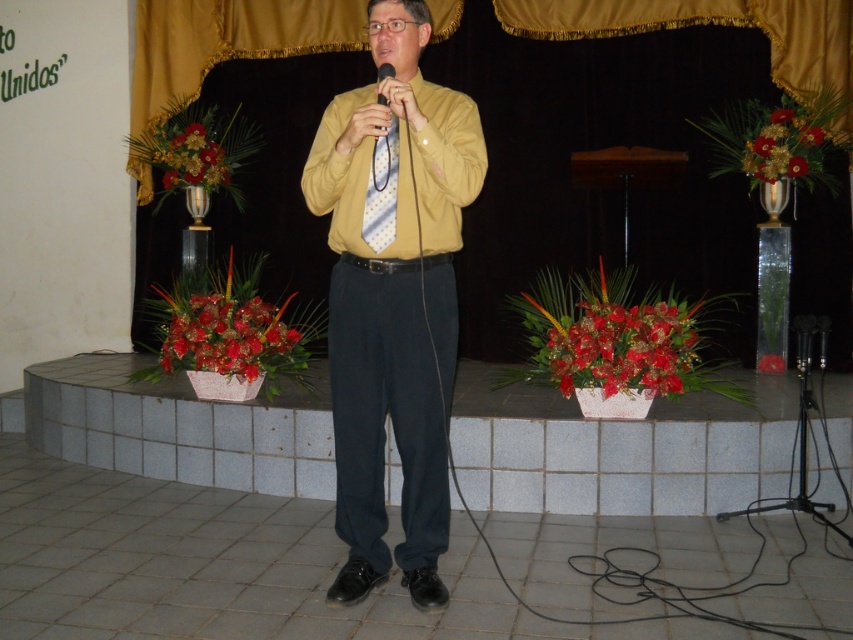
You are an audience member sitting in the front row of the stage. You want to hand the speaker a note. The note is in your pocket, and you need to reach out to him. Considering the distance between you and the yellow matte shirt at center, is it possible to reach him without leaving your seat?

The yellow matte shirt at center and viewer are 8.22 feet apart from each other. Since the average human arm length is about 2.5 feet, it would be impossible to reach the speaker without leaving your seat as the distance is much greater than the arm length.

You are a photographer setting up for a speech event. You need to ensure that the yellow smooth dress shirt at center is visible in the frame without being blocked by the matte black microphone at center. Given their sizes, which object should you position closer to the camera to achieve this?

The yellow smooth dress shirt at center is wider than the matte black microphone at center, so positioning the yellow smooth dress shirt at center closer to the camera will ensure it remains visible and not blocked by the microphone.

The man is wearing a yellow smooth dress shirt at center and holding a matte black microphone at center. Which object takes up more space in the image?

The yellow smooth dress shirt at center is bigger than the matte black microphone at center, so it takes up more space in the image.